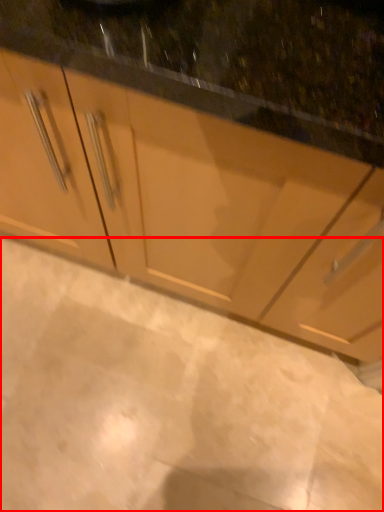
Question: From the image's perspective, what is the correct spatial relationship of granite (annotated by the red box) in relation to cabinetry?

Choices:
 (A) below
 (B) above

Answer: (A)